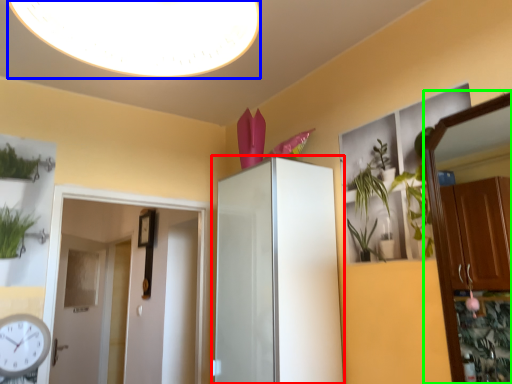
Question: Which object is the closest to the cabinetry (highlighted by a red box)? Choose among these: light fixture (highlighted by a blue box) or dresser (highlighted by a green box).

Choices:
 (A) light fixture
 (B) dresser

Answer: (A)